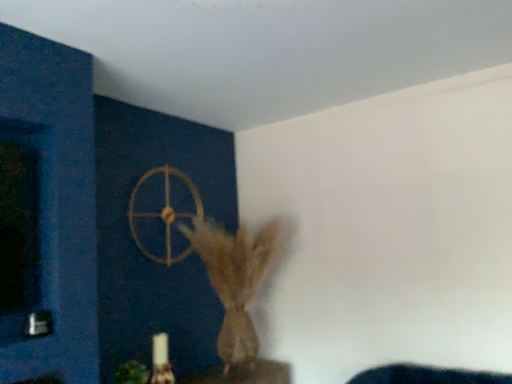
Question: Is point (168, 193) positioned closer to the camera than point (133, 377)?

Choices:
 (A) farther
 (B) closer

Answer: (A)

Question: Is gold metallic wheel at upper center bigger or smaller than green matte plant at lower left?

Choices:
 (A) big
 (B) small

Answer: (A)

Question: Considering the real-world distances, which object is farthest from the green matte plant at lower left?

Choices:
 (A) gold metallic wheel at upper center
 (B) brown textured vase at center

Answer: (A)

Question: Which object is the closest to the green matte plant at lower left?

Choices:
 (A) gold metallic wheel at upper center
 (B) brown textured vase at center

Answer: (B)